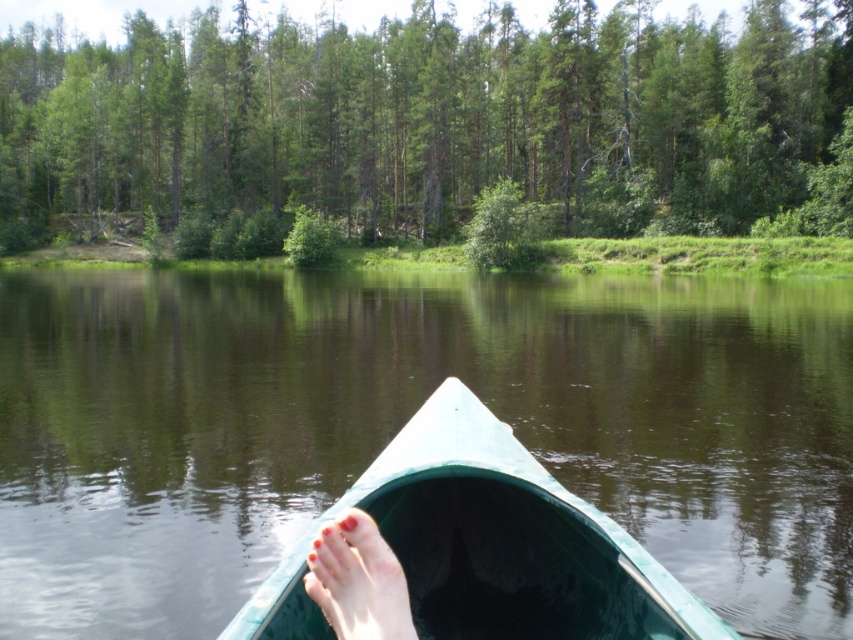
Question: Can you confirm if green leafy tree at upper center is thinner than green plastic boat at center?

Choices:
 (A) yes
 (B) no

Answer: (B)

Question: Which is farther from the green smooth water at center?

Choices:
 (A) green plastic boat at center
 (B) smooth pink skin at lower center
 (C) green leafy tree at upper center

Answer: (C)

Question: From the image, what is the correct spatial relationship of green smooth water at center in relation to smooth pink skin at lower center?

Choices:
 (A) right
 (B) left

Answer: (B)

Question: Which object is closer to the camera taking this photo?

Choices:
 (A) green plastic boat at center
 (B) smooth pink skin at lower center
 (C) green leafy tree at upper center

Answer: (B)

Question: Is green plastic boat at center bigger than smooth pink skin at lower center?

Choices:
 (A) yes
 (B) no

Answer: (A)

Question: Which object appears farthest from the camera in this image?

Choices:
 (A) green plastic boat at center
 (B) smooth pink skin at lower center
 (C) green smooth water at center

Answer: (C)